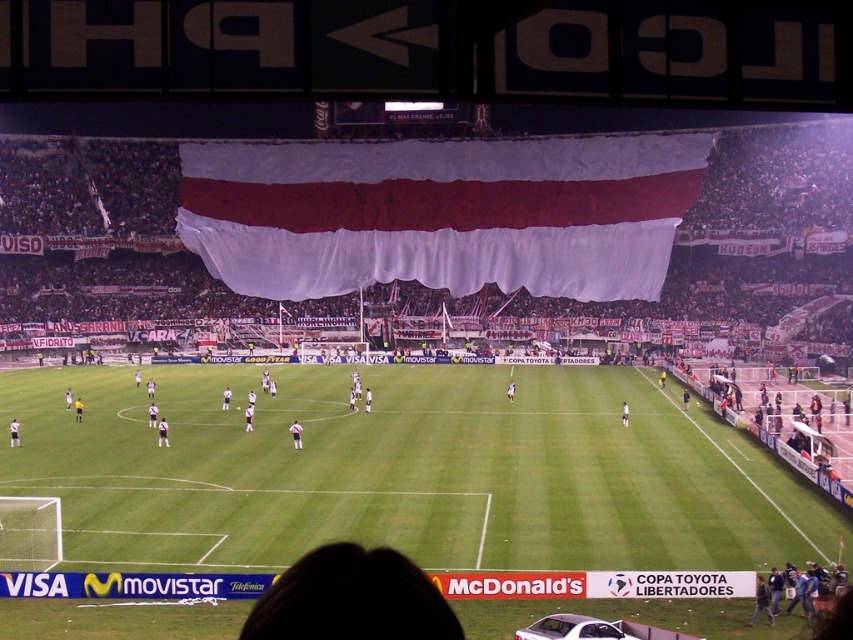
Does point (105, 451) lie in front of point (564, 248)?

Yes, it is in front of point (564, 248).

Is point (65, 536) farther from viewer compared to point (509, 264)?

No, it is not.

What are the coordinates of `green grass football field at center` in the screenshot? It's located at (405, 472).